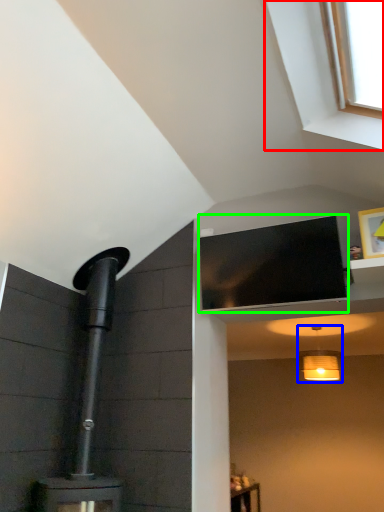
Question: Based on their relative distances, which object is farther from window (highlighted by a red box)? Choose from light fixture (highlighted by a blue box) and window screen (highlighted by a green box).

Choices:
 (A) light fixture
 (B) window screen

Answer: (A)